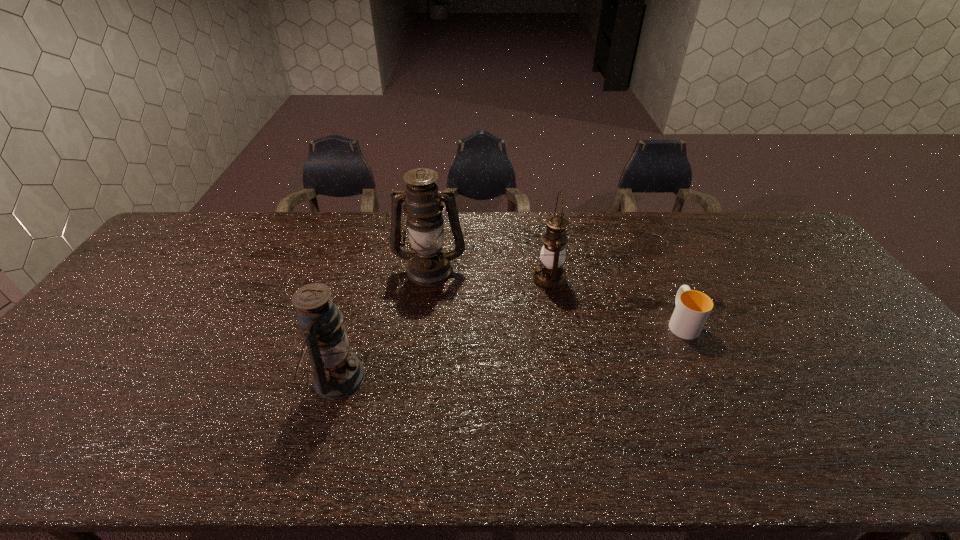
Find the location of a particular element. free space between the leftmost oil lamp and the second oil lamp from left to right is located at coordinates (383, 323).

The height and width of the screenshot is (540, 960). I want to click on free spot between the rightmost oil lamp and the second oil lamp from right to left, so click(490, 274).

This screenshot has height=540, width=960. Find the location of `blank region between the nearest object and the rightmost oil lamp`. blank region between the nearest object and the rightmost oil lamp is located at coordinates (444, 328).

This screenshot has width=960, height=540. I want to click on unoccupied area between the second oil lamp from left to right and the second object from right to left, so click(490, 274).

Identify the location of free space between the rightmost oil lamp and the second oil lamp from left to right. The width and height of the screenshot is (960, 540). (490, 274).

The width and height of the screenshot is (960, 540). In order to click on vacant space that's between the cup and the nearest object in this screenshot , I will do [x=509, y=349].

The width and height of the screenshot is (960, 540). What are the coordinates of `vacant space in between the rightmost oil lamp and the leftmost object` in the screenshot? It's located at (444, 328).

I want to click on blank region between the third object from right to left and the rightmost oil lamp, so click(x=490, y=274).

Identify the location of free spot between the nearest object and the third object from right to left. The image size is (960, 540). (383, 323).

Locate an element on the screen. object that is the third closest one to the third farthest object is located at coordinates (337, 372).